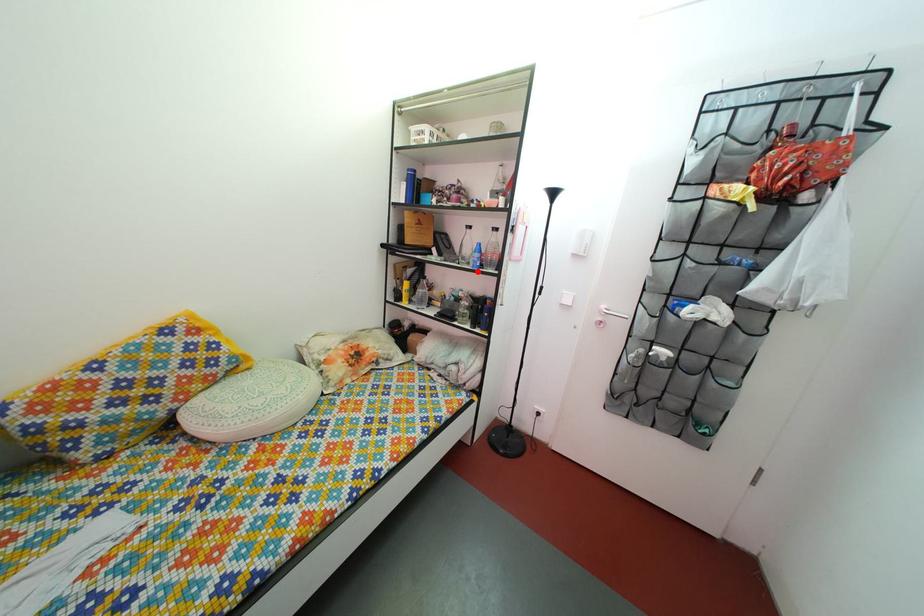
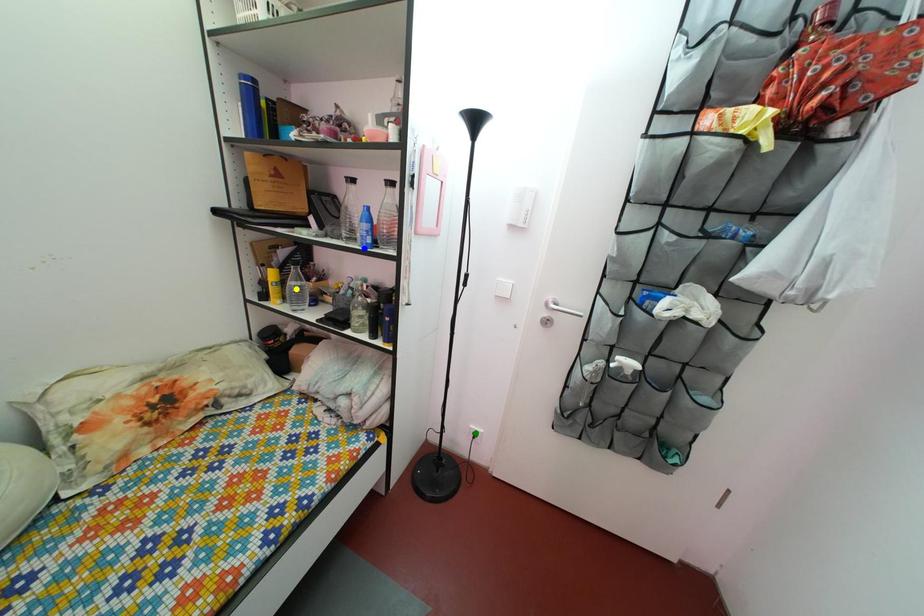
Question: I am providing you with two images of the same scene from different viewpoints. A red point is marked on the first image. You are given multiple points on the second image. Which point in image 2 represents the same 3d spot as the red point in image 1?

Choices:
 (A) yellow point
 (B) green point
 (C) blue point

Answer: (C)